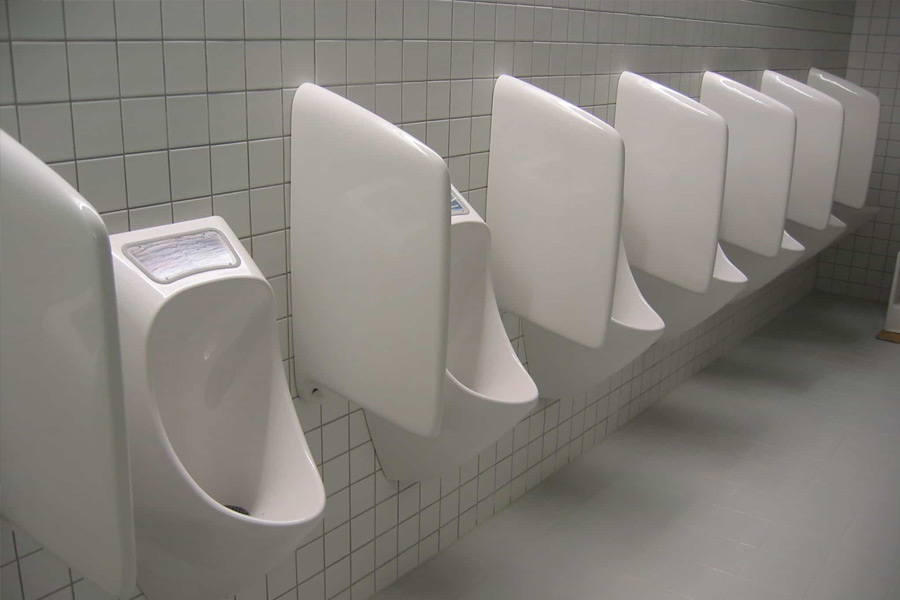
Find the location of `urinal divider`. urinal divider is located at coordinates (95, 454), (311, 334), (567, 221), (670, 206), (767, 169), (819, 163), (860, 147).